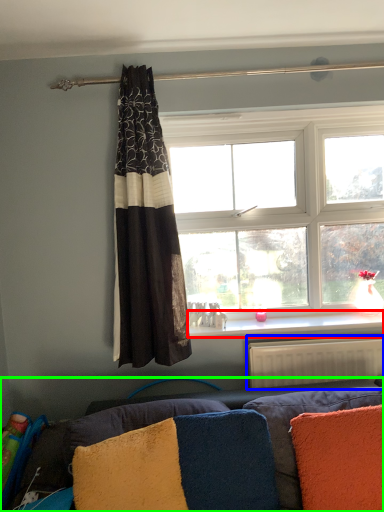
Question: Considering the real-world distances, which object is closest to window sill (highlighted by a red box)? radiator (highlighted by a blue box) or studio couch (highlighted by a green box).

Choices:
 (A) radiator
 (B) studio couch

Answer: (A)